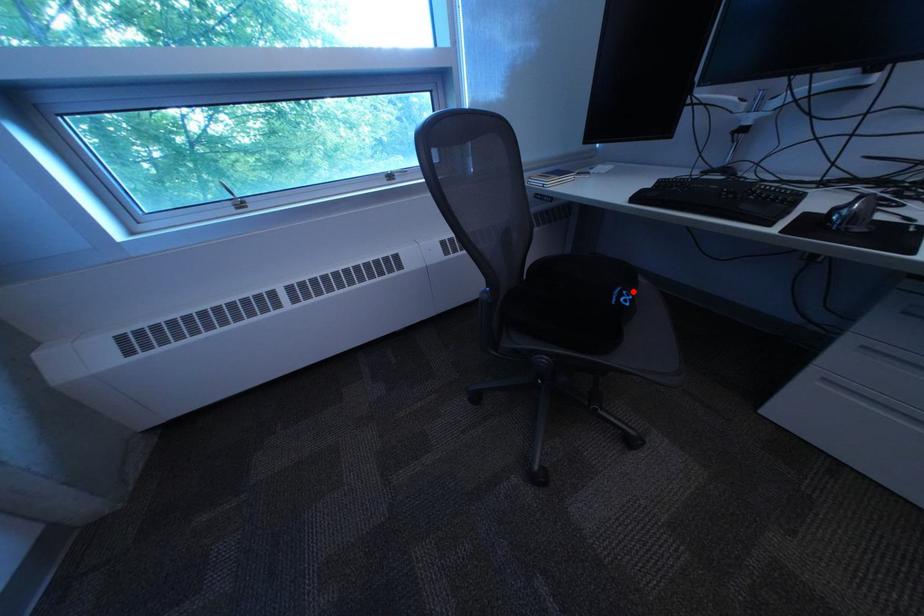
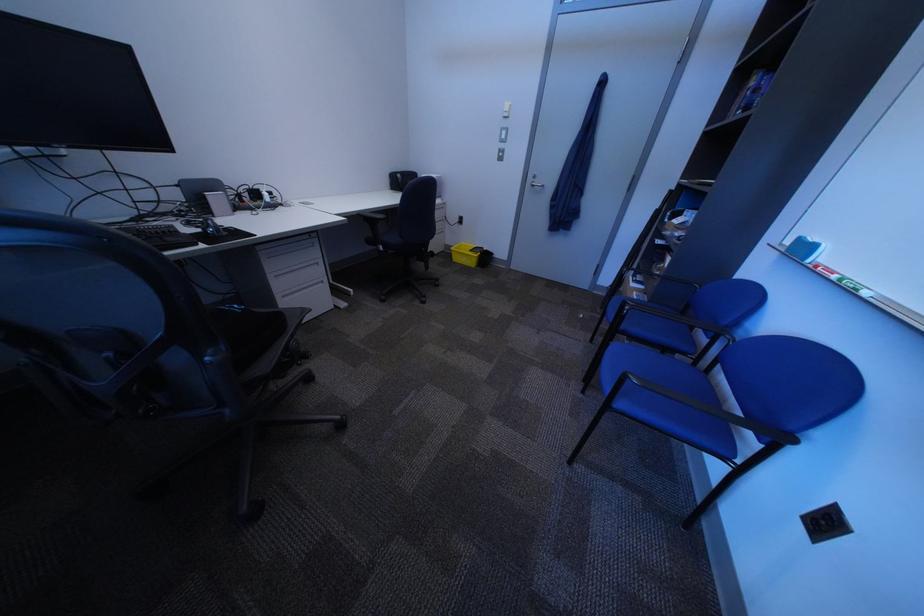
Question: A red point is marked in image1. In image2, is the corresponding 3D point closer to the camera or farther? Reply with the corresponding letter.

Choices:
 (A) The corresponding 3D point is closer.
 (B) The corresponding 3D point is farther.

Answer: (A)